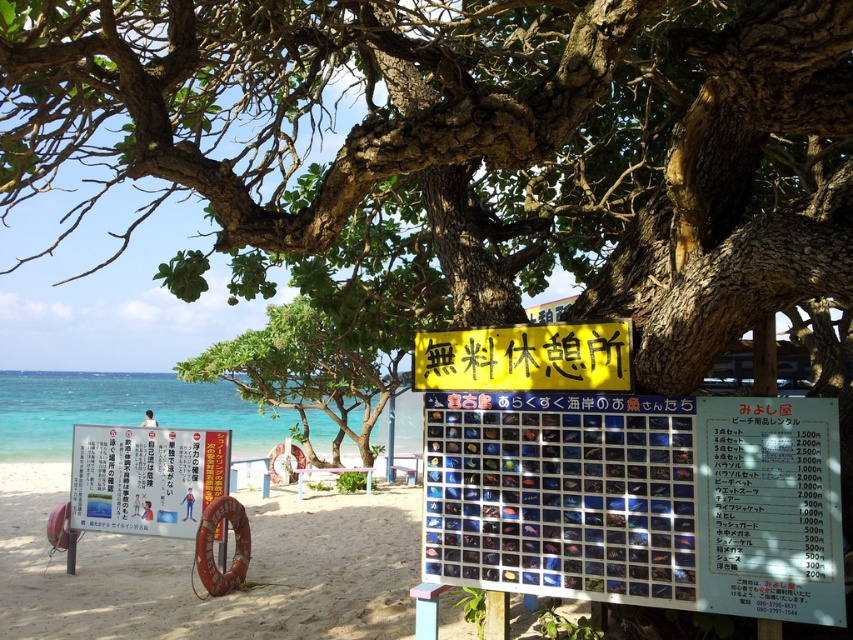
Is yellow paper at center above green leafy tree at center?

Incorrect, yellow paper at center is not positioned above green leafy tree at center.

Between yellow paper at center and green leafy tree at center, which one has more height?

green leafy tree at center is taller.

I want to click on yellow paper at center, so click(637, 500).

Find the location of `green leafy tree at center`. green leafy tree at center is located at coordinates (306, 369).

Which is behind, point (306, 298) or point (106, 512)?

The point (306, 298) is behind.

Is point (241, 394) positioned after point (184, 461)?

Yes.

At what (x,y) coordinates should I click in order to perform the action: click on green leafy tree at center. Please return your answer as a coordinate pair (x, y). Looking at the image, I should click on (306, 369).

Which is in front, point (766, 602) or point (198, 452)?

Point (766, 602)

Who is positioned more to the left, yellow paper at center or white paper sign at lower left?

Positioned to the left is white paper sign at lower left.

Which is in front, point (502, 467) or point (144, 477)?

Point (502, 467) is more forward.

Find the location of a particular element. yellow paper at center is located at coordinates (637, 500).